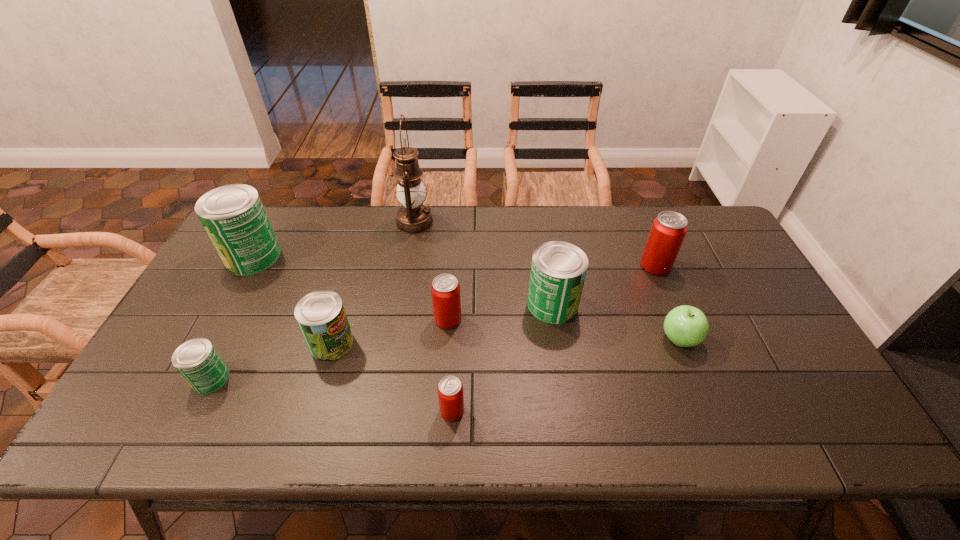
The height and width of the screenshot is (540, 960). In order to click on oil lamp in this screenshot , I will do `click(413, 217)`.

In order to click on the farthest object in this screenshot , I will do `click(413, 217)`.

Where is `the farthest green can`? the farthest green can is located at coordinates (233, 216).

This screenshot has height=540, width=960. I want to click on the second tallest object, so 233,216.

I want to click on the rightmost can, so click(668, 231).

Find the location of a particular element. the rightmost red can is located at coordinates (668, 231).

Find the location of a particular element. The image size is (960, 540). the rightmost green can is located at coordinates (558, 270).

The height and width of the screenshot is (540, 960). What are the coordinates of `the third object from right to left` in the screenshot? It's located at (558, 270).

Identify the location of the second biggest red can. Image resolution: width=960 pixels, height=540 pixels. (445, 290).

Locate an element on the screen. the second nearest green can is located at coordinates (321, 316).